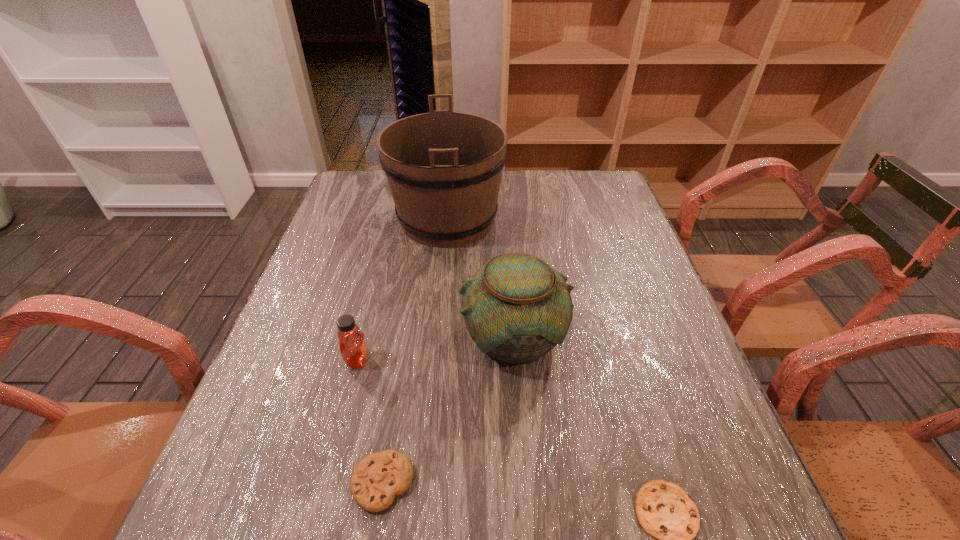
At what (x,y) coordinates should I click in order to perform the action: click on free space between the fourth shortest object and the third shortest object. Please return your answer as a coordinate pair (x, y). Looking at the image, I should click on (435, 347).

Where is `free space between the pottery and the second shortest object`? free space between the pottery and the second shortest object is located at coordinates (447, 409).

In order to click on free spot between the taller cookie and the pottery in this screenshot , I will do `click(447, 409)`.

Image resolution: width=960 pixels, height=540 pixels. I want to click on vacant region between the third shortest object and the left cookie, so pos(370,421).

The image size is (960, 540). What are the coordinates of `object that can be found as the third closest to the third shortest object` in the screenshot? It's located at (444, 168).

Identify which object is the closest to the pottery. Please provide its 2D coordinates. Your answer should be formatted as a tuple, i.e. [(x, y)], where the tuple contains the x and y coordinates of a point satisfying the conditions above.

[(444, 168)]

The height and width of the screenshot is (540, 960). Find the location of `free location that satisfies the following two spatial constraints: 1. on the front side of the tallest object; 2. on the front label of the honey`. free location that satisfies the following two spatial constraints: 1. on the front side of the tallest object; 2. on the front label of the honey is located at coordinates (434, 360).

Find the location of `free location that satisfies the following two spatial constraints: 1. on the back side of the taller cookie; 2. on the front label of the honey`. free location that satisfies the following two spatial constraints: 1. on the back side of the taller cookie; 2. on the front label of the honey is located at coordinates (402, 360).

You are a GUI agent. You are given a task and a screenshot of the screen. Output one action in this format:
    pyautogui.click(x=<x>, y=<y>)
    Task: Click on the free point that satisfies the following two spatial constraints: 1. on the front side of the bucket; 2. on the front label of the honey
    This screenshot has width=960, height=540.
    Given the screenshot: What is the action you would take?
    pyautogui.click(x=434, y=360)

This screenshot has height=540, width=960. I want to click on vacant space that satisfies the following two spatial constraints: 1. on the front label of the taller cookie; 2. on the left side of the honey, so click(326, 482).